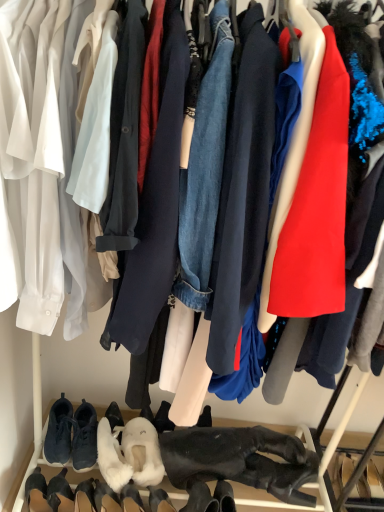
Question: Does black suede boot at lower left, which is the eighth footwear in right-to-left order, turn towards dark blue suede sneakers at lower left, which is counted as the second footwear, starting from the left?

Choices:
 (A) yes
 (B) no

Answer: (B)

Question: Is black suede boot at lower left, which is the eighth footwear in right-to-left order, smaller than dark blue suede sneakers at lower left, which appears as the seventh footwear when viewed from the right?

Choices:
 (A) no
 (B) yes

Answer: (B)

Question: Can you confirm if black suede boot at lower left, the first footwear when ordered from left to right, is taller than dark blue suede sneakers at lower left, which appears as the seventh footwear when viewed from the right?

Choices:
 (A) no
 (B) yes

Answer: (B)

Question: Does black suede boot at lower left, which is the eighth footwear in right-to-left order, have a greater width compared to dark blue suede sneakers at lower left, which appears as the seventh footwear when viewed from the right?

Choices:
 (A) yes
 (B) no

Answer: (B)

Question: Is the surface of black suede boot at lower left, which is the eighth footwear in right-to-left order, in direct contact with dark blue suede sneakers at lower left, which is counted as the second footwear, starting from the left?

Choices:
 (A) yes
 (B) no

Answer: (B)

Question: Is dark gray suede sneakers at lower left, the fifth footwear positioned from the right, spatially inside white fluffy slippers at lower center, which is the 7th footwear from left to right, or outside of it?

Choices:
 (A) inside
 (B) outside

Answer: (B)

Question: From the image's perspective, is dark gray suede sneakers at lower left, the fifth footwear positioned from the right, above or below white fluffy slippers at lower center, which is the 7th footwear from left to right?

Choices:
 (A) above
 (B) below

Answer: (A)

Question: From their relative heights in the image, would you say dark gray suede sneakers at lower left, positioned as the 4th footwear in left-to-right order, is taller or shorter than white fluffy slippers at lower center, which is the 7th footwear from left to right?

Choices:
 (A) tall
 (B) short

Answer: (A)

Question: Looking at their shapes, would you say dark gray suede sneakers at lower left, positioned as the 4th footwear in left-to-right order, is wider or thinner than white fluffy slippers at lower center, the second footwear viewed from the right?

Choices:
 (A) thin
 (B) wide

Answer: (A)

Question: Visually, is dark blue suede sneakers at lower left, which is counted as the second footwear, starting from the left, positioned to the left or to the right of black suede boot at lower left, the first footwear when ordered from left to right?

Choices:
 (A) right
 (B) left

Answer: (A)

Question: Is dark blue suede sneakers at lower left, which appears as the seventh footwear when viewed from the right, spatially inside black suede boot at lower left, the first footwear when ordered from left to right, or outside of it?

Choices:
 (A) outside
 (B) inside

Answer: (A)

Question: Is dark blue suede sneakers at lower left, which is counted as the second footwear, starting from the left, in front of or behind black suede boot at lower left, which is the eighth footwear in right-to-left order, in the image?

Choices:
 (A) behind
 (B) front

Answer: (A)

Question: Does point (56, 445) appear closer or farther from the camera than point (29, 503)?

Choices:
 (A) farther
 (B) closer

Answer: (A)

Question: From a real-world perspective, relative to white suede boot at lower left, the 6th footwear from the right, is white fluffy slippers at lower center, which is the 7th footwear from left to right, vertically above or below?

Choices:
 (A) above
 (B) below

Answer: (A)

Question: Based on their positions, is white fluffy slippers at lower center, which is the 7th footwear from left to right, located to the left or right of white suede boot at lower left, the 6th footwear from the right?

Choices:
 (A) right
 (B) left

Answer: (A)